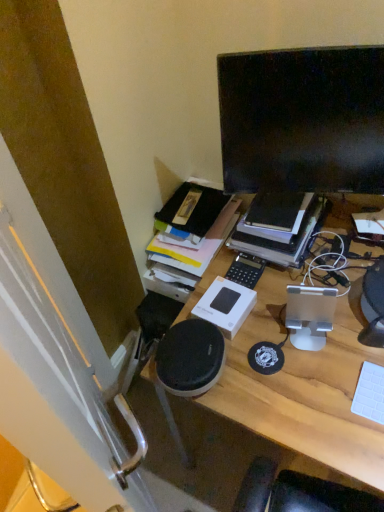
You are a GUI agent. You are given a task and a screenshot of the screen. Output one action in this format:
    pyautogui.click(x=<x>, y=<y>)
    Task: Click on the wooden desk at center
    The height and width of the screenshot is (512, 384).
    Given the screenshot: What is the action you would take?
    pyautogui.click(x=304, y=385)

The height and width of the screenshot is (512, 384). Describe the element at coordinates (303, 120) in the screenshot. I see `black glossy monitor at upper right` at that location.

You are a GUI agent. You are given a task and a screenshot of the screen. Output one action in this format:
    pyautogui.click(x=<x>, y=<y>)
    Task: Click on the hardcover book at upper center
    This screenshot has height=512, width=384.
    Given the screenshot: What is the action you would take?
    pyautogui.click(x=279, y=241)

Looking at this image, is white matte keyboard at right to the left of wooden desk at center from the viewer's perspective?

No.

Can you tell me how much white matte keyboard at right and wooden desk at center differ in facing direction?

white matte keyboard at right and wooden desk at center are facing 0.609 degrees away from each other.

Identify the location of desk below the white matte keyboard at right (from a real-world perspective). (304, 385).

In order to click on book that appears behind the white matte keyboard at right in this screenshot , I will do `click(279, 241)`.

In terms of width, does white matte keyboard at right look wider or thinner when compared to hardcover book at upper center?

Considering their sizes, white matte keyboard at right looks slimmer than hardcover book at upper center.

From a real-world perspective, does white matte keyboard at right stand above hardcover book at upper center?

No, from a real-world perspective, white matte keyboard at right is not on top of hardcover book at upper center.

Who is bigger, white matte keyboard at right or hardcover book at upper center?

hardcover book at upper center.

Is wooden desk at center far from hardcover book at upper center?

No, there isn't a large distance between wooden desk at center and hardcover book at upper center.

Which is in front, point (351, 414) or point (313, 220)?

Point (351, 414)

From the image's perspective, is wooden desk at center above or below hardcover book at upper center?

Clearly, from the image's perspective, wooden desk at center is below hardcover book at upper center.

From a real-world perspective, which is physically above, hardcover book at upper center or white matte keyboard at right?

hardcover book at upper center, from a real-world perspective.

Is hardcover book at upper center bigger than white matte keyboard at right?

Correct, hardcover book at upper center is larger in size than white matte keyboard at right.

From the picture: Considering the relative sizes of hardcover book at upper center and white matte keyboard at right in the image provided, is hardcover book at upper center wider than white matte keyboard at right?

Yes, hardcover book at upper center is wider than white matte keyboard at right.

Is black glossy monitor at upper right positioned far away from hardcover book at upper center?

No, black glossy monitor at upper right is not far away from hardcover book at upper center.

Based on the photo, from a real-world perspective, who is located higher, black glossy monitor at upper right or hardcover book at upper center?

black glossy monitor at upper right, from a real-world perspective.

Is black glossy monitor at upper right taller than hardcover book at upper center?

Indeed, black glossy monitor at upper right has a greater height compared to hardcover book at upper center.

Is black glossy monitor at upper right positioned before hardcover book at upper center?

Yes, black glossy monitor at upper right is closer to the camera.

Is hardcover book at upper center taller than wooden desk at center?

In fact, hardcover book at upper center may be shorter than wooden desk at center.

Is hardcover book at upper center placed right next to wooden desk at center?

No, hardcover book at upper center is not beside wooden desk at center.

Is wooden desk at center surrounded by hardcover book at upper center?

That's incorrect, wooden desk at center is not inside hardcover book at upper center.

Does hardcover book at upper center appear on the right side of wooden desk at center?

No.

Consider the image. Which point is more distant from viewer, (261, 302) or (378, 414)?

The point (261, 302) is more distant.

From the image's perspective, between wooden desk at center and white matte keyboard at right, which one is located above?

From the image's view, white matte keyboard at right is above.

How much distance is there between wooden desk at center and white matte keyboard at right?

The distance of wooden desk at center from white matte keyboard at right is 8.71 inches.

Which of these two, wooden desk at center or white matte keyboard at right, is smaller?

With smaller size is white matte keyboard at right.

Where is `computer keyboard behind the wooden desk at center`? Image resolution: width=384 pixels, height=512 pixels. computer keyboard behind the wooden desk at center is located at coordinates (369, 393).

Where is `computer keyboard in front of the hardcover book at upper center`? The width and height of the screenshot is (384, 512). computer keyboard in front of the hardcover book at upper center is located at coordinates (369, 393).

Which object lies further to the anchor point wooden desk at center, black glossy monitor at upper right or white matte keyboard at right?

The object further to wooden desk at center is black glossy monitor at upper right.

Considering their positions, is wooden desk at center positioned closer to hardcover book at upper center than white matte keyboard at right?

wooden desk at center is positioned closer to the anchor hardcover book at upper center.

From the image, which object appears to be nearer to hardcover book at upper center, white matte keyboard at right or black glossy monitor at upper right?

Among the two, black glossy monitor at upper right is located nearer to hardcover book at upper center.

Looking at the image, which one is located further to white matte keyboard at right, hardcover book at upper center or wooden desk at center?

hardcover book at upper center is positioned further to the anchor white matte keyboard at right.

Which object lies nearer to the anchor point black glossy monitor at upper right, wooden desk at center or hardcover book at upper center?

Based on the image, hardcover book at upper center appears to be nearer to black glossy monitor at upper right.

Looking at the image, which one is located closer to white matte keyboard at right, black glossy monitor at upper right or hardcover book at upper center?

hardcover book at upper center is positioned closer to the anchor white matte keyboard at right.

Looking at the image, which one is located further to black glossy monitor at upper right, hardcover book at upper center or wooden desk at center?

wooden desk at center is further to black glossy monitor at upper right.

Based on the photo, looking at the image, which one is located closer to wooden desk at center, hardcover book at upper center or black glossy monitor at upper right?

hardcover book at upper center is closer to wooden desk at center.

At what (x,y) coordinates should I click in order to perform the action: click on book between black glossy monitor at upper right and white matte keyboard at right in the up-down direction. Please return your answer as a coordinate pair (x, y). The image size is (384, 512). Looking at the image, I should click on (279, 241).

Identify the location of computer keyboard between hardcover book at upper center and wooden desk at center from top to bottom. This screenshot has width=384, height=512. (369, 393).

You are a GUI agent. You are given a task and a screenshot of the screen. Output one action in this format:
    pyautogui.click(x=<x>, y=<y>)
    Task: Click on the computer keyboard between black glossy monitor at upper right and wooden desk at center in the vertical direction
    
    Given the screenshot: What is the action you would take?
    pyautogui.click(x=369, y=393)

The image size is (384, 512). What are the coordinates of `book between black glossy monitor at upper right and wooden desk at center in the up-down direction` in the screenshot? It's located at (279, 241).